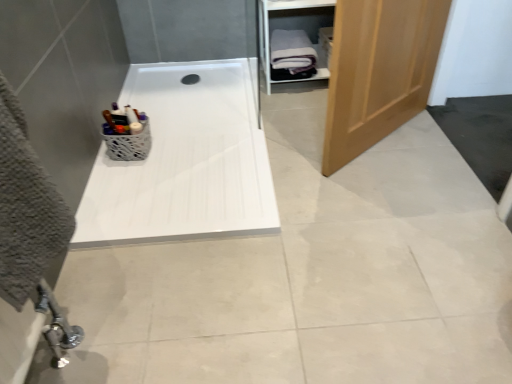
Identify the location of wooden door at right. The image size is (512, 384). (378, 71).

What are the coordinates of `white textured basket at upper left` in the screenshot? It's located at (128, 142).

The height and width of the screenshot is (384, 512). I want to click on white glossy bath at center, so click(185, 161).

Describe the element at coordinates (185, 161) in the screenshot. I see `white glossy bath at center` at that location.

The width and height of the screenshot is (512, 384). In order to click on white wood cabinet at upper right in this screenshot , I will do `click(293, 29)`.

Where is `door that appears in front of the white glossy bath at center`? Image resolution: width=512 pixels, height=384 pixels. door that appears in front of the white glossy bath at center is located at coordinates (378, 71).

Is white glossy bath at center further to the viewer compared to wooden door at right?

Yes, it is.

Does point (196, 134) lie behind point (414, 57)?

Yes, point (196, 134) is farther from viewer.

Is white glossy bath at center turned away from wooden door at right?

No, white glossy bath at center's orientation is not away from wooden door at right.

Considering the sizes of objects white textured basket at upper left and white wood cabinet at upper right in the image provided, who is wider, white textured basket at upper left or white wood cabinet at upper right?

With larger width is white wood cabinet at upper right.

Does point (144, 127) lie in front of point (285, 2)?

Yes, point (144, 127) is in front of point (285, 2).

Is white textured basket at upper left spatially inside white wood cabinet at upper right, or outside of it?

white textured basket at upper left is not enclosed by white wood cabinet at upper right.

In terms of size, does white textured basket at upper left appear bigger or smaller than white soft towel at upper right?

Clearly, white textured basket at upper left is smaller in size than white soft towel at upper right.

Does white textured basket at upper left appear on the left side of white soft towel at upper right?

Indeed, white textured basket at upper left is positioned on the left side of white soft towel at upper right.

From the image's perspective, who appears lower, white textured basket at upper left or white soft towel at upper right?

white textured basket at upper left, from the image's perspective.

The height and width of the screenshot is (384, 512). Find the location of `door above the white wood cabinet at upper right (from a real-world perspective)`. door above the white wood cabinet at upper right (from a real-world perspective) is located at coordinates (378, 71).

Consider the image. Relative to wooden door at right, is white wood cabinet at upper right in front or behind?

white wood cabinet at upper right is behind wooden door at right.

From a real-world perspective, who is located higher, white wood cabinet at upper right or wooden door at right?

wooden door at right.

How much distance is there between white soft towel at upper right and wooden door at right?

76.79 centimeters.

Is white soft towel at upper right touching wooden door at right?

They are not placed beside each other.

How different are the orientations of white soft towel at upper right and wooden door at right in degrees?

white soft towel at upper right and wooden door at right are facing 40 degrees away from each other.

Does point (310, 66) lie behind point (416, 36)?

Yes, point (310, 66) is farther from viewer.

Is white glossy bath at center thinner than white textured basket at upper left?

Incorrect, the width of white glossy bath at center is not less than that of white textured basket at upper left.

Can you confirm if white glossy bath at center is smaller than white textured basket at upper left?

No, white glossy bath at center is not smaller than white textured basket at upper left.

Can you tell me how much white glossy bath at center and white textured basket at upper left differ in facing direction?

white glossy bath at center and white textured basket at upper left are facing 90 degrees away from each other.

Considering the sizes of wooden door at right and white wood cabinet at upper right in the image, is wooden door at right wider or thinner than white wood cabinet at upper right?

Considering their sizes, wooden door at right looks slimmer than white wood cabinet at upper right.

Does wooden door at right turn towards white wood cabinet at upper right?

No, wooden door at right is not facing towards white wood cabinet at upper right.

Considering the relative sizes of wooden door at right and white wood cabinet at upper right in the image provided, is wooden door at right smaller than white wood cabinet at upper right?

Incorrect, wooden door at right is not smaller in size than white wood cabinet at upper right.

Is wooden door at right touching white wood cabinet at upper right?

They are not placed beside each other.

Identify the location of door in front of the white glossy bath at center. (378, 71).

Image resolution: width=512 pixels, height=384 pixels. In order to click on cabinet above the white textured basket at upper left (from a real-world perspective) in this screenshot , I will do `click(293, 29)`.

Considering their positions, is white wood cabinet at upper right positioned further to white soft towel at upper right than white textured basket at upper left?

Based on the image, white textured basket at upper left appears to be further to white soft towel at upper right.

Considering their positions, is wooden door at right positioned closer to white soft towel at upper right than white wood cabinet at upper right?

Based on the image, white wood cabinet at upper right appears to be nearer to white soft towel at upper right.

Estimate the real-world distances between objects in this image. Which object is closer to wooden door at right, white wood cabinet at upper right or white soft towel at upper right?

white soft towel at upper right is closer to wooden door at right.

Based on their spatial positions, is white textured basket at upper left or white glossy bath at center closer to white wood cabinet at upper right?

white glossy bath at center is closer to white wood cabinet at upper right.

Which object lies nearer to the anchor point white glossy bath at center, white wood cabinet at upper right or wooden door at right?

white wood cabinet at upper right.

Looking at the image, which one is located closer to wooden door at right, white textured basket at upper left or white glossy bath at center?

white glossy bath at center lies closer to wooden door at right than the other object.

Based on their spatial positions, is white textured basket at upper left or white wood cabinet at upper right closer to wooden door at right?

The object closer to wooden door at right is white wood cabinet at upper right.

Based on their spatial positions, is white glossy bath at center or white textured basket at upper left closer to wooden door at right?

white glossy bath at center is positioned closer to the anchor wooden door at right.

Find the location of a particular element. bath located between white textured basket at upper left and white soft towel at upper right in the left-right direction is located at coordinates (185, 161).

I want to click on bath towel located between white textured basket at upper left and white wood cabinet at upper right in the left-right direction, so click(x=291, y=55).

The height and width of the screenshot is (384, 512). In order to click on bath between wooden door at right and white soft towel at upper right in the front-back direction in this screenshot , I will do `click(185, 161)`.

Find the location of `bath between white textured basket at upper left and white wood cabinet at upper right from left to right`. bath between white textured basket at upper left and white wood cabinet at upper right from left to right is located at coordinates (185, 161).